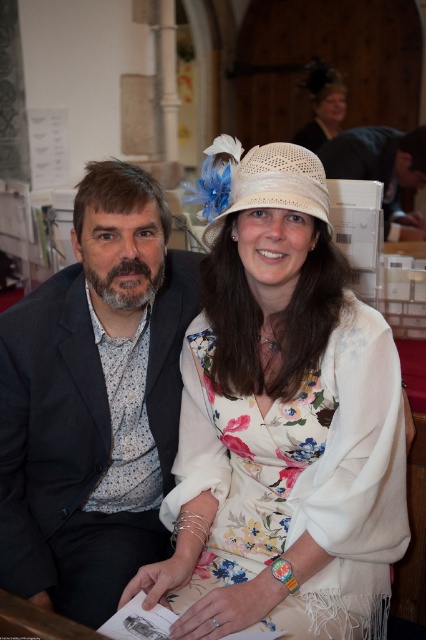
Which is below, floral silk dress at center or white straw hat at center?

floral silk dress at center is lower down.

Between floral silk dress at center and white straw hat at center, which one is positioned higher?

Positioned higher is white straw hat at center.

Image resolution: width=426 pixels, height=640 pixels. What are the coordinates of `floral silk dress at center` in the screenshot? It's located at pyautogui.click(x=301, y=477).

At what (x,y) coordinates should I click in order to perform the action: click on floral silk dress at center. Please return your answer as a coordinate pair (x, y). Looking at the image, I should click on (301, 477).

What do you see at coordinates (94, 401) in the screenshot? I see `dark gray suit at center` at bounding box center [94, 401].

Between point (2, 577) and point (400, 163), which one is positioned behind?

Point (400, 163)

Find the location of a particular element. The width and height of the screenshot is (426, 640). dark gray suit at center is located at coordinates (94, 401).

You are a GUI agent. You are given a task and a screenshot of the screen. Output one action in this format:
    pyautogui.click(x=<x>, y=<y>)
    Task: Click on the dark gray suit at center
    The height and width of the screenshot is (640, 426).
    Given the screenshot: What is the action you would take?
    [94, 401]